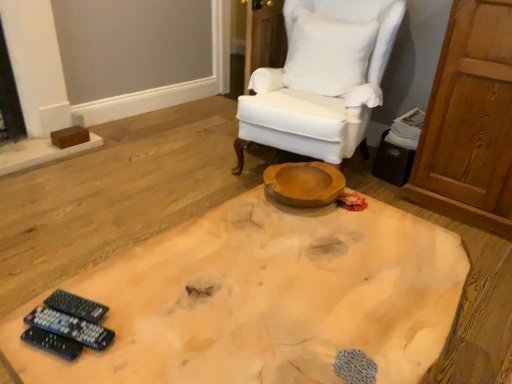
The width and height of the screenshot is (512, 384). What are the coordinates of `free area behind black plastic remote controls at lower left, arranged as the 1th remote control when viewed from the front` in the screenshot? It's located at (113, 280).